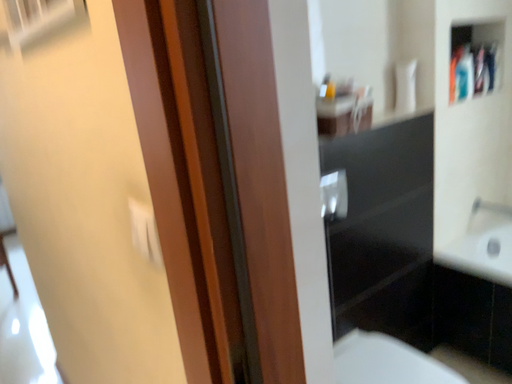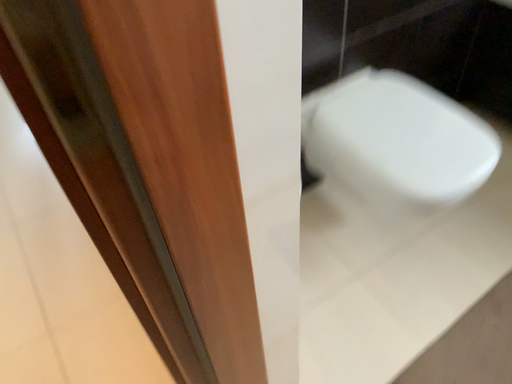
Question: How did the camera likely rotate when shooting the video?

Choices:
 (A) rotated downward
 (B) rotated upward

Answer: (A)